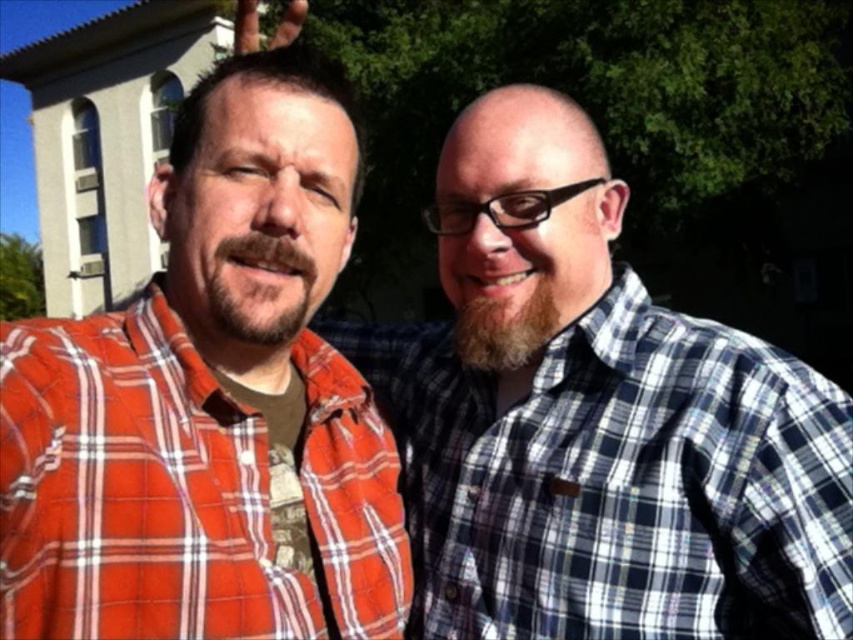
Does plaid shirt at center appear on the left side of red plaid shirt at left?

Incorrect, plaid shirt at center is not on the left side of red plaid shirt at left.

Does plaid shirt at center have a smaller size compared to red plaid shirt at left?

No, plaid shirt at center is not smaller than red plaid shirt at left.

Where is `plaid shirt at center`? The width and height of the screenshot is (853, 640). plaid shirt at center is located at coordinates (596, 420).

Identify the location of plaid shirt at center. (596, 420).